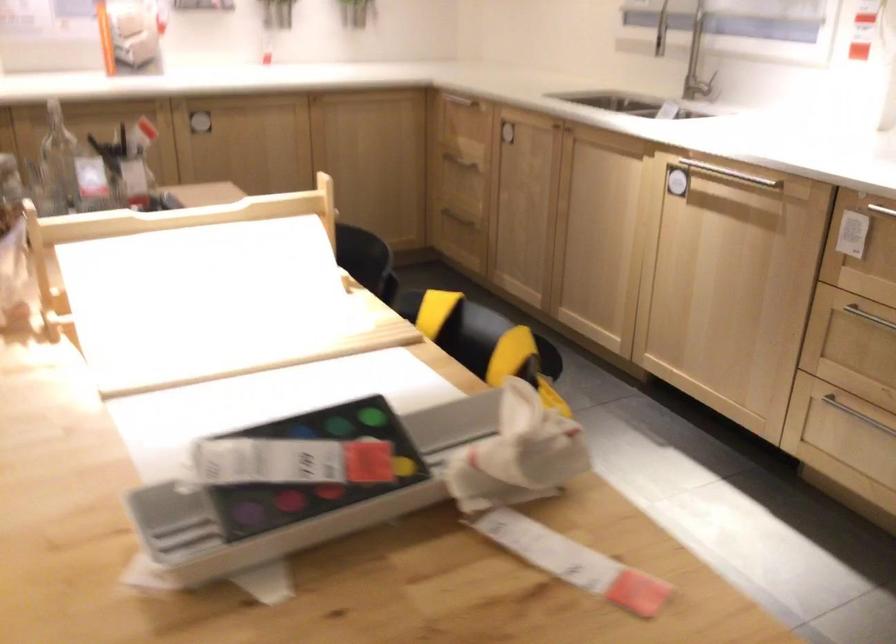
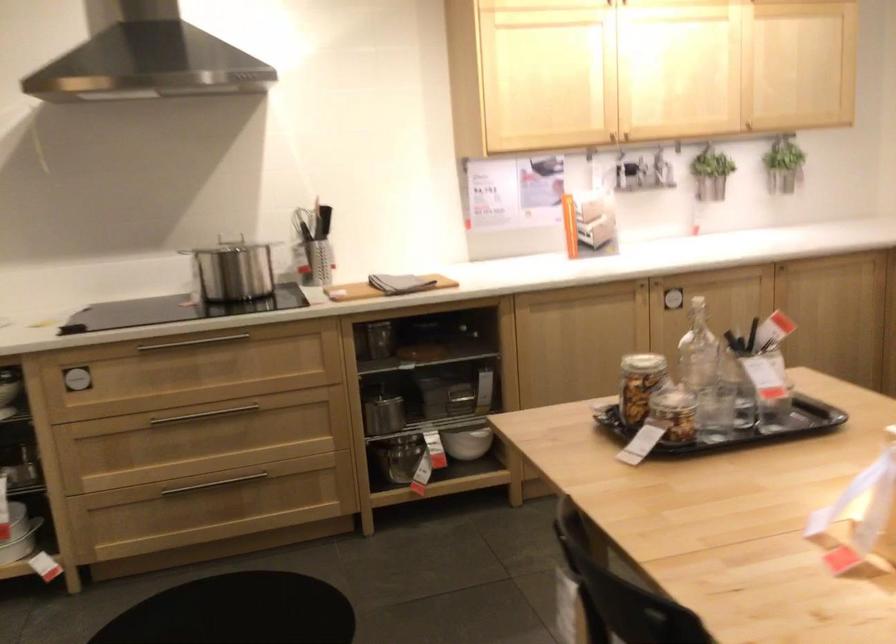
Question: In a continuous first-person perspective shot, in which direction is the camera moving?

Choices:
 (A) Left
 (B) Right
 (C) Forward
 (D) Backward

Answer: (A)